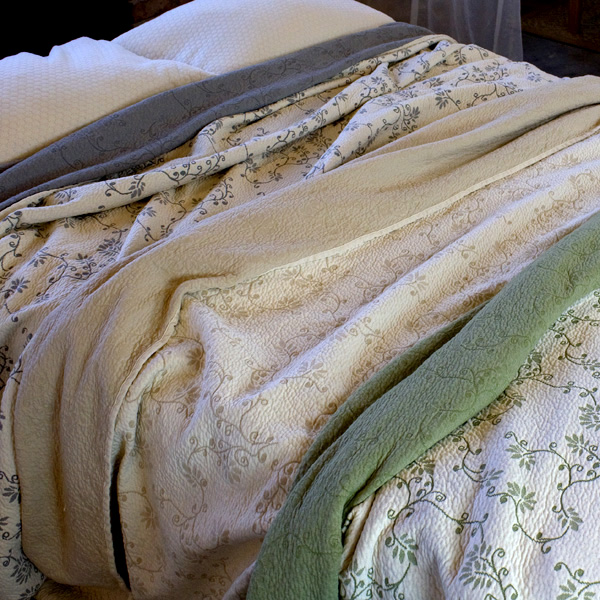
Find the location of a particular element. This screenshot has width=600, height=600. cream blanket is located at coordinates (231, 162).